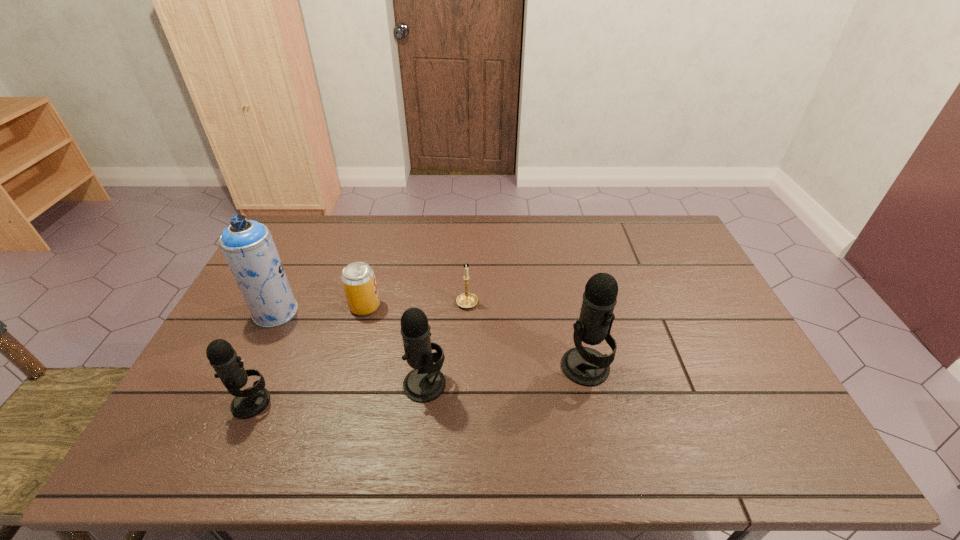
Where is `free region at the near edge of the desktop`? This screenshot has width=960, height=540. free region at the near edge of the desktop is located at coordinates (501, 398).

The image size is (960, 540). Identify the location of vacant space at the left edge. (229, 329).

In the image, there is a desktop. At what (x,y) coordinates should I click in order to perform the action: click on blank space at the right edge. Please return your answer as a coordinate pair (x, y). Looking at the image, I should click on (753, 360).

This screenshot has height=540, width=960. I want to click on blank area at the far left corner, so pyautogui.click(x=316, y=242).

At what (x,y) coordinates should I click in order to perform the action: click on vacant space at the far right corner of the desktop. Please return your answer as a coordinate pair (x, y). The height and width of the screenshot is (540, 960). Looking at the image, I should click on (649, 239).

Image resolution: width=960 pixels, height=540 pixels. I want to click on free space between the rightmost object and the second microphone from right to left, so click(x=505, y=376).

The image size is (960, 540). Identify the location of empty location between the third object from right to left and the second object from right to left. (445, 343).

At what (x,y) coordinates should I click in order to perform the action: click on vacant space that is in between the aerosol can and the fourth tallest object. Please return your answer as a coordinate pair (x, y). This screenshot has height=540, width=960. Looking at the image, I should click on (264, 357).

Where is `free point between the shortest microphone and the second microphone from left to right`? Image resolution: width=960 pixels, height=540 pixels. free point between the shortest microphone and the second microphone from left to right is located at coordinates (338, 394).

The image size is (960, 540). Find the location of `empty space that is in between the rightmost object and the third object from left to right`. empty space that is in between the rightmost object and the third object from left to right is located at coordinates (475, 337).